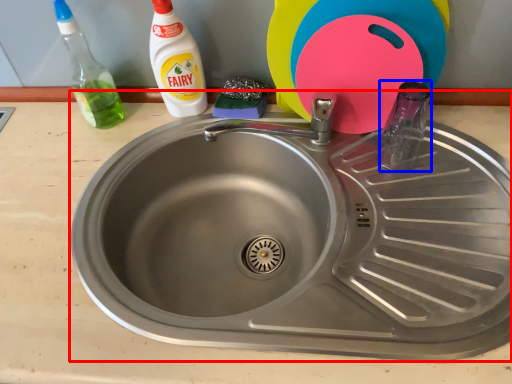
Question: Which object is closer to the camera taking this photo, sink (highlighted by a red box) or bottle (highlighted by a blue box)?

Choices:
 (A) sink
 (B) bottle

Answer: (A)